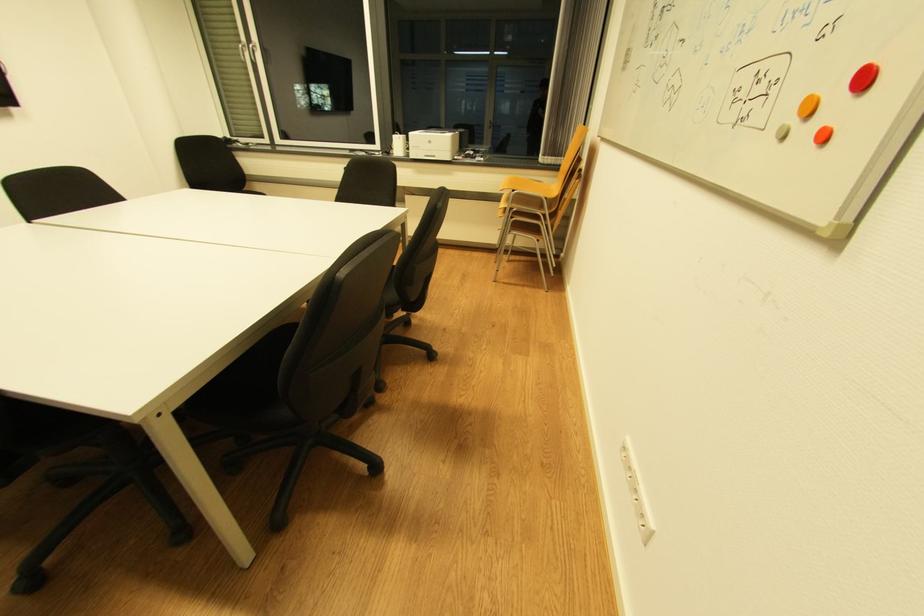
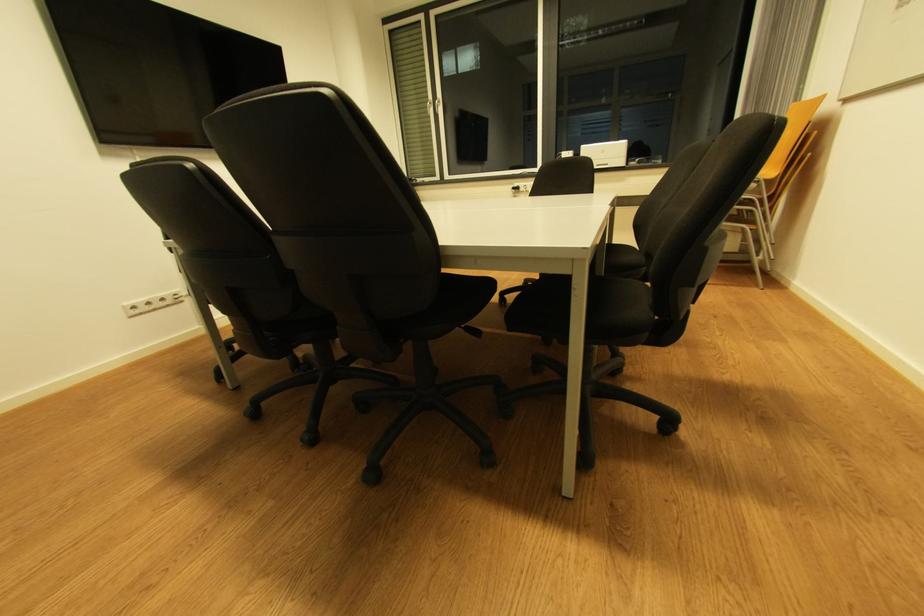
Question: Which direction would the cameraman need to move to produce the second image? Reply with the corresponding letter.

Choices:
 (A) Left
 (B) Right
 (C) Forward
 (D) Backward

Answer: (A)